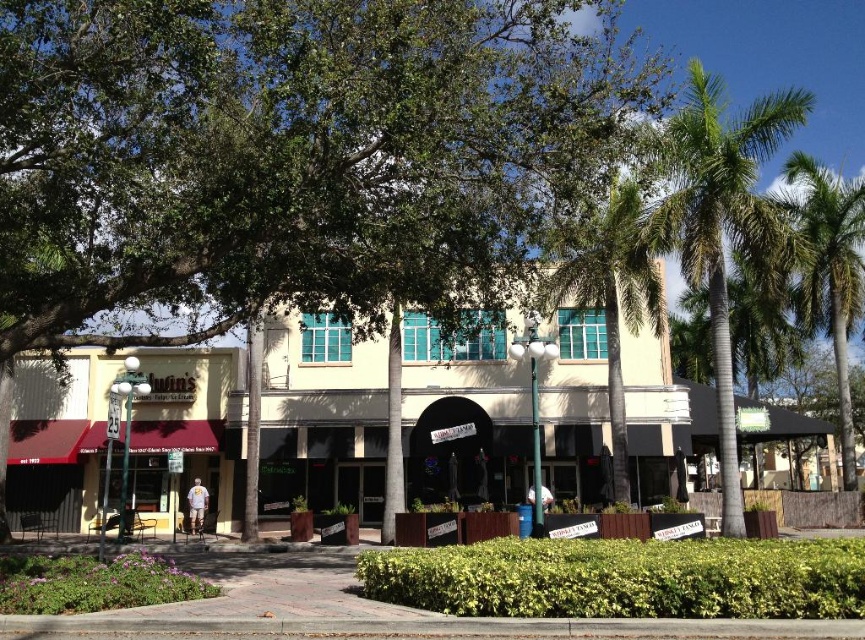
You are a tourist standing in front of the beige building with the teal windows. You notice two green leafy palm trees in the scene. Which palm tree is nearer to you, the green leafy palm tree at upper right or the green leafy palm tree at right?

The green leafy palm tree at upper right is closer to the viewer than the green leafy palm tree at right.

You are a city planner assessing the street layout. You need to determine if the green leafy tree at center and beige concrete storefront at center can both fit within a 10m by 10m plot. Given their sizes, is this feasible?

The green leafy tree at center is larger in size than the beige concrete storefront at center. However, without specific measurements of their individual sizes, it is impossible to determine if both can fit within a 10m by 10m plot based on the provided information.

You are a visitor standing on the sidewalk in front of the beige concrete storefront at center. You want to take a photo of the Chambers sign located above the entrance. However, there is a green leafy tree at center blocking your view. Can you still see the sign clearly?

The green leafy tree at center is much taller than the beige concrete storefront at center, so the tree might be blocking the view of the Chambers sign above the entrance. You may need to move to a different angle or position to get a clear shot of the sign.